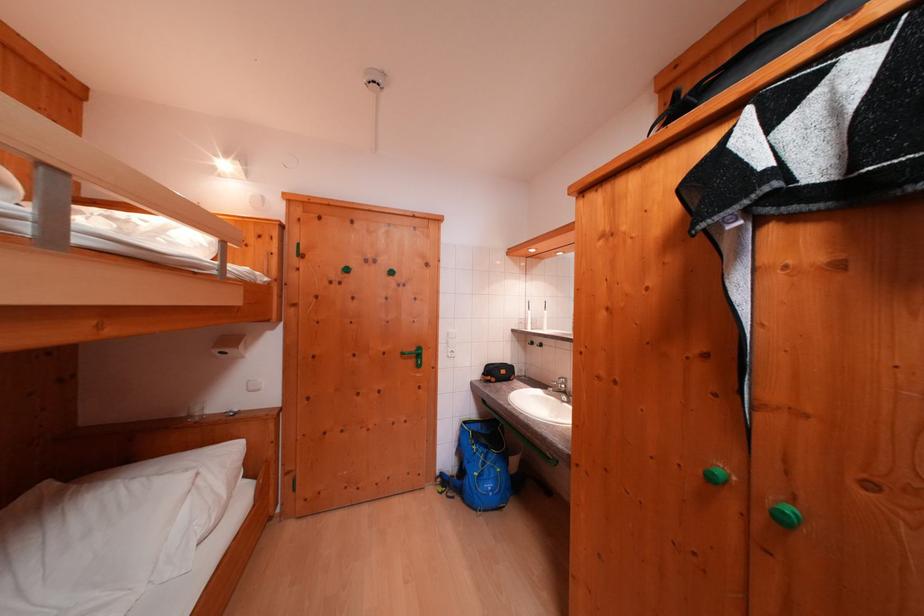
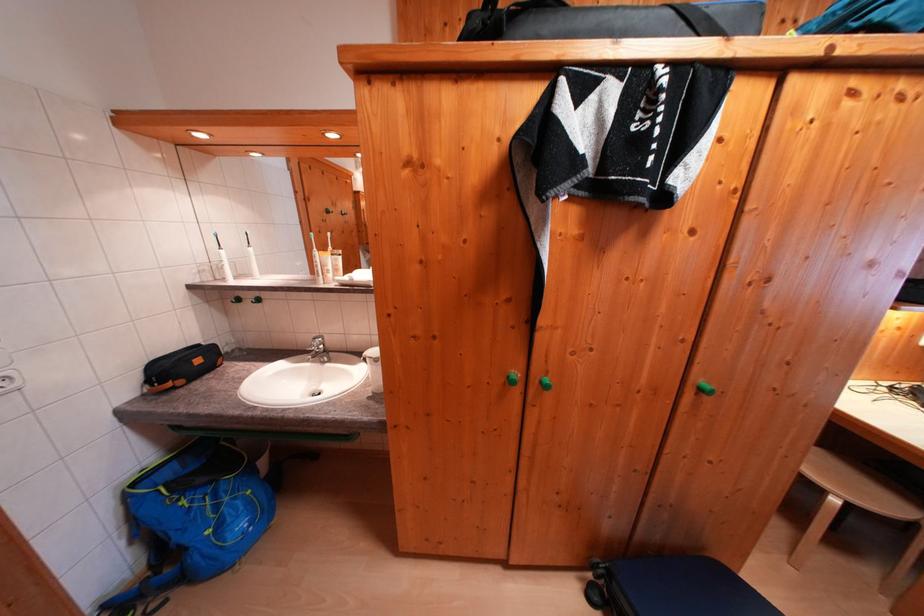
Where in the second image is the point corresponding to [473,427] from the first image?

(142, 488)